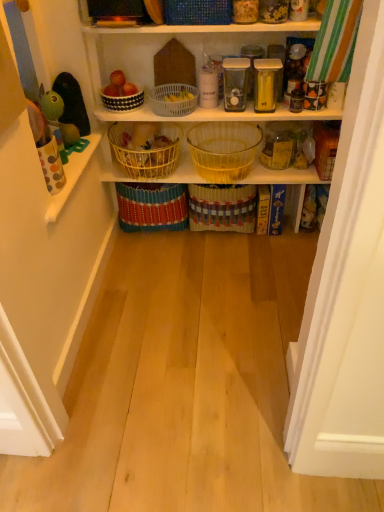
Question: Considering the relative sizes of translucent yellow glass basket at center, placed as the third basket when sorted from bottom to top, and white plastic basket at upper center, marked as the fifth basket in a bottom-to-top arrangement, in the image provided, is translucent yellow glass basket at center, placed as the third basket when sorted from bottom to top, shorter than white plastic basket at upper center, marked as the fifth basket in a bottom-to-top arrangement,?

Choices:
 (A) no
 (B) yes

Answer: (A)

Question: Can you confirm if translucent yellow glass basket at center, the 5th basket positioned from the top, is bigger than white plastic basket at upper center, marked as the fifth basket in a bottom-to-top arrangement?

Choices:
 (A) no
 (B) yes

Answer: (B)

Question: Considering the relative sizes of translucent yellow glass basket at center, placed as the third basket when sorted from bottom to top, and white plastic basket at upper center, marked as the fifth basket in a bottom-to-top arrangement, in the image provided, is translucent yellow glass basket at center, placed as the third basket when sorted from bottom to top, wider than white plastic basket at upper center, marked as the fifth basket in a bottom-to-top arrangement,?

Choices:
 (A) yes
 (B) no

Answer: (A)

Question: Does translucent yellow glass basket at center, placed as the third basket when sorted from bottom to top, turn towards white plastic basket at upper center, which is counted as the third basket, starting from the top?

Choices:
 (A) no
 (B) yes

Answer: (A)

Question: Is translucent yellow glass basket at center, the 5th basket positioned from the top, outside white plastic basket at upper center, marked as the fifth basket in a bottom-to-top arrangement?

Choices:
 (A) no
 (B) yes

Answer: (B)

Question: Is translucent yellow glass basket at center, the 5th basket positioned from the top, closer to the viewer compared to white plastic basket at upper center, marked as the fifth basket in a bottom-to-top arrangement?

Choices:
 (A) yes
 (B) no

Answer: (B)

Question: Would you say white plastic basket at upper center, which is counted as the third basket, starting from the top, is outside bright yellow woven basket at center, which appears as the 2th basket when ordered from the bottom?

Choices:
 (A) no
 (B) yes

Answer: (B)

Question: Considering the relative sizes of white plastic basket at upper center, marked as the fifth basket in a bottom-to-top arrangement, and bright yellow woven basket at center, which appears as the 6th basket when viewed from the top, in the image provided, is white plastic basket at upper center, marked as the fifth basket in a bottom-to-top arrangement, shorter than bright yellow woven basket at center, which appears as the 6th basket when viewed from the top,?

Choices:
 (A) no
 (B) yes

Answer: (B)

Question: Is bright yellow woven basket at center, which appears as the 6th basket when viewed from the top, surrounded by white plastic basket at upper center, marked as the fifth basket in a bottom-to-top arrangement?

Choices:
 (A) no
 (B) yes

Answer: (A)

Question: Is white plastic basket at upper center, which is counted as the third basket, starting from the top, facing towards bright yellow woven basket at center, which appears as the 6th basket when viewed from the top?

Choices:
 (A) no
 (B) yes

Answer: (A)

Question: Are white plastic basket at upper center, marked as the fifth basket in a bottom-to-top arrangement, and bright yellow woven basket at center, which appears as the 2th basket when ordered from the bottom, beside each other?

Choices:
 (A) yes
 (B) no

Answer: (B)

Question: Is white plastic basket at upper center, marked as the fifth basket in a bottom-to-top arrangement, positioned far away from bright yellow woven basket at center, which appears as the 2th basket when ordered from the bottom?

Choices:
 (A) no
 (B) yes

Answer: (A)

Question: From a real-world perspective, is white plastic basket at upper center, marked as the fifth basket in a bottom-to-top arrangement, positioned over white dotted bowl at upper center, placed as the second basket when sorted from top to bottom, based on gravity?

Choices:
 (A) no
 (B) yes

Answer: (A)